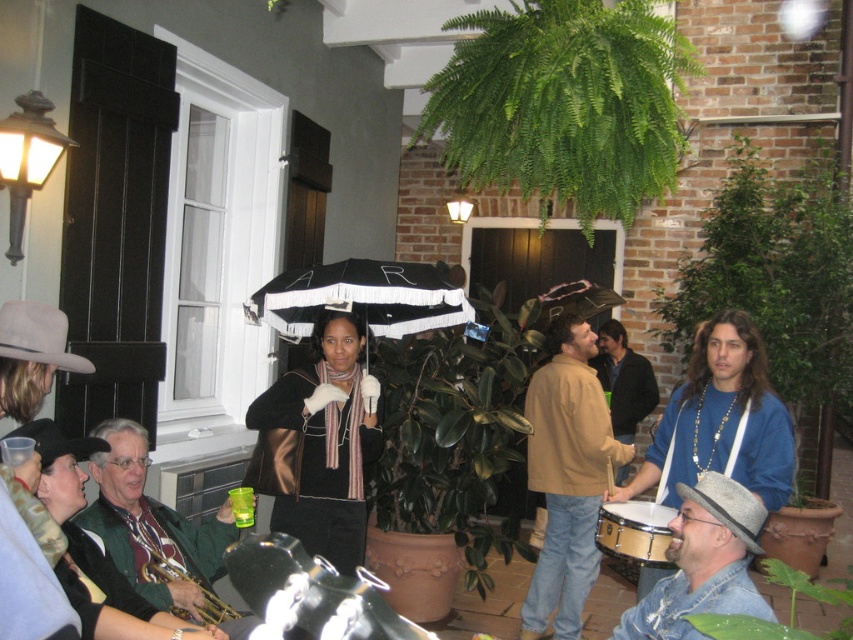
Question: Does green velvet jacket at lower left have a lesser width compared to black fabric umbrella at center?

Choices:
 (A) yes
 (B) no

Answer: (A)

Question: Does black matte umbrella at center appear on the right side of gold brass trumpet at lower left?

Choices:
 (A) no
 (B) yes

Answer: (B)

Question: Which of the following is the farthest from the observer?

Choices:
 (A) (851, 268)
 (B) (674, 35)
 (C) (813, 586)

Answer: (A)

Question: Which object is positioned farthest from the wooden snare drum at lower center?

Choices:
 (A) gold brass trumpet at lower left
 (B) green velvet jacket at lower left
 (C) metallic gold jacket at center

Answer: (B)

Question: Which point appears farthest from the camera in this image?

Choices:
 (A) (753, 204)
 (B) (337, 387)
 (C) (123, 452)

Answer: (A)

Question: Is green leafy plant at upper center bigger than green leafy plant at right?

Choices:
 (A) yes
 (B) no

Answer: (B)